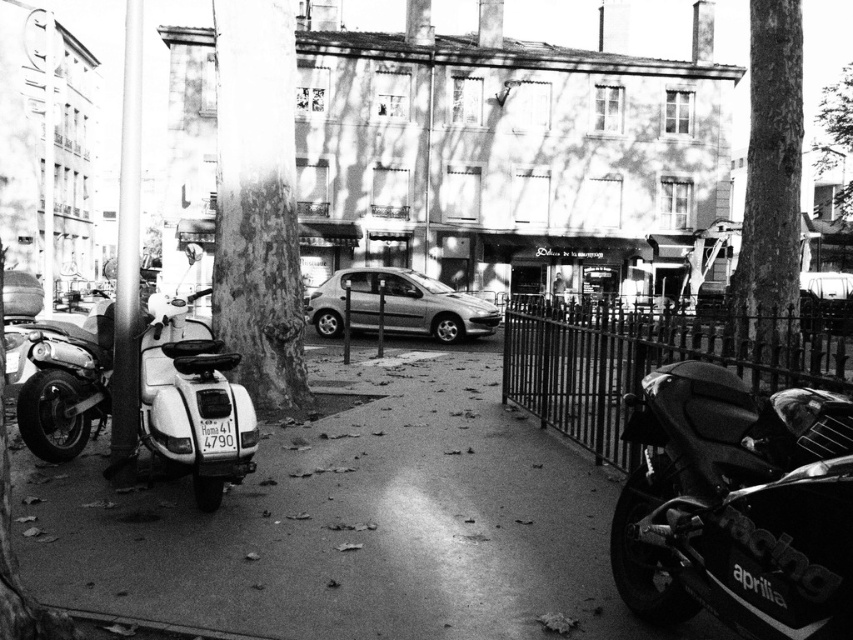
Measure the distance between smooth asphalt pavement at center and metallic silver car at center.

smooth asphalt pavement at center is 32.66 feet from metallic silver car at center.

Between point (165, 502) and point (386, 280), which one is positioned in front?

Point (165, 502) is in front.

This screenshot has height=640, width=853. I want to click on smooth asphalt pavement at center, so click(x=352, y=520).

Is point (700, 333) closer to camera compared to point (437, 291)?

Yes, point (700, 333) is closer to viewer.

Where is `dark iron fence at right`? Image resolution: width=853 pixels, height=640 pixels. dark iron fence at right is located at coordinates (645, 360).

Is white matte scooter at left bigger than rough bark tree at upper right?

Actually, white matte scooter at left might be smaller than rough bark tree at upper right.

Describe the element at coordinates (192, 401) in the screenshot. I see `white matte scooter at left` at that location.

This screenshot has width=853, height=640. Identify the location of white matte scooter at left. (192, 401).